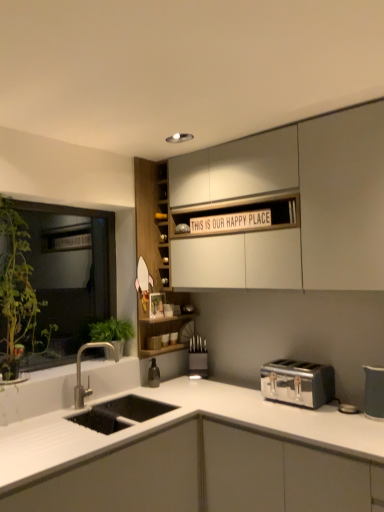
This screenshot has height=512, width=384. I want to click on vacant space to the right of satin nickel faucet at lower left, so click(x=130, y=410).